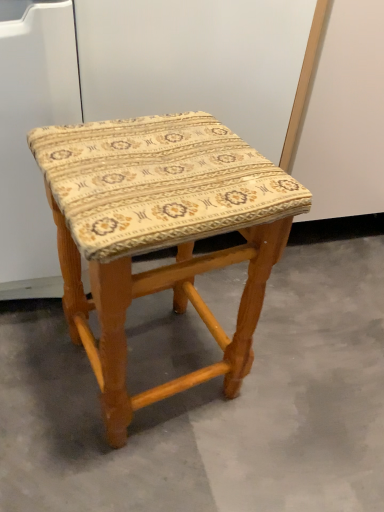
Find the location of `vacant space in wooden stool at center (from a real-world perspective)`. vacant space in wooden stool at center (from a real-world perspective) is located at coordinates (167, 360).